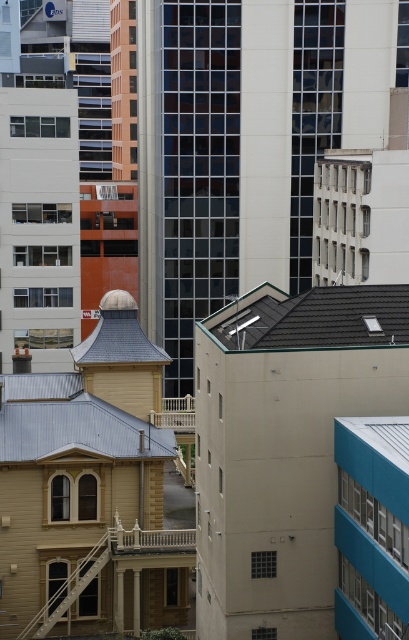
Is the position of gray tile roof at center less distant than that of metallic gray roof at center?

Yes.

Locate an element on the screen. gray tile roof at center is located at coordinates (314, 317).

Is point (254, 346) closer to viewer compared to point (128, 432)?

That is True.

This screenshot has height=640, width=409. What are the coordinates of `gray tile roof at center` in the screenshot? It's located at (314, 317).